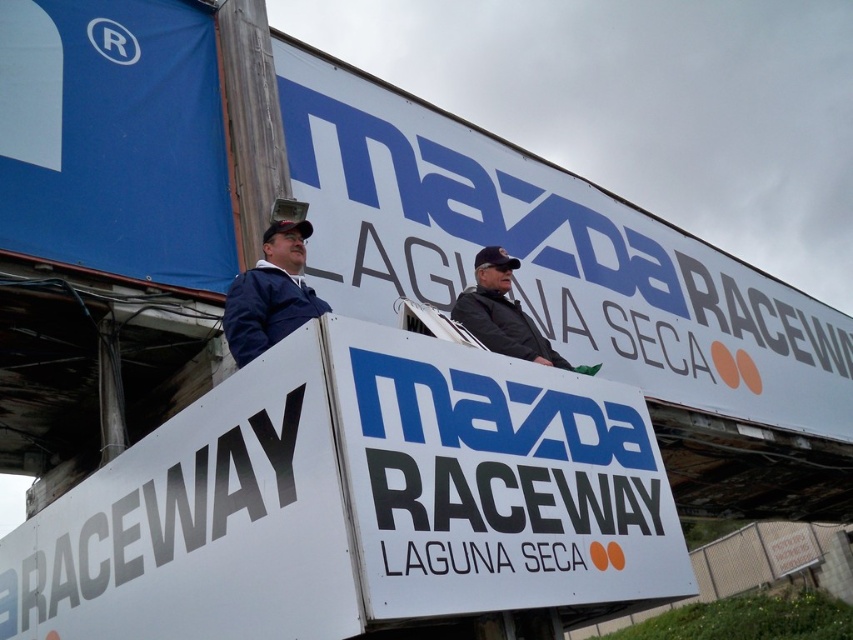
You are a photographer positioned at the front of the platform. You need to capture a photo of both the white plastic billboard at center and the white matte sign at center without any obstruction. Which object should you place closer to the camera to ensure both are fully visible in the frame?

Since the white plastic billboard at center might be wider than the white matte sign at center, placing the white plastic billboard at center closer to the camera would help ensure both are fully visible in the frame, as wider objects require more space in the foreground to capture their full width.

You are a photographer at Mazda Raceway Laguna Seca. You need to capture a photo that includes both the white plastic billboard at center and the blue fabric at upper left. Which object should be placed closer to the camera to ensure both fit in the frame?

The white plastic billboard at center is taller than the blue fabric at upper left, so to ensure both fit in the frame, the blue fabric at upper left should be placed closer to the camera since it is shorter and requires less vertical space.

You are attending an outdoor event at Mazda Raceway Laguna Seca and see two people on a platform. One is wearing a blue fabric jacket at upper left and the other a black leather jacket at center. From the perspective of someone standing in front of the platform, which jacket is positioned to the left?

The blue fabric jacket at upper left is positioned to the left of the black leather jacket at center, so the blue fabric jacket at upper left is on the left side.